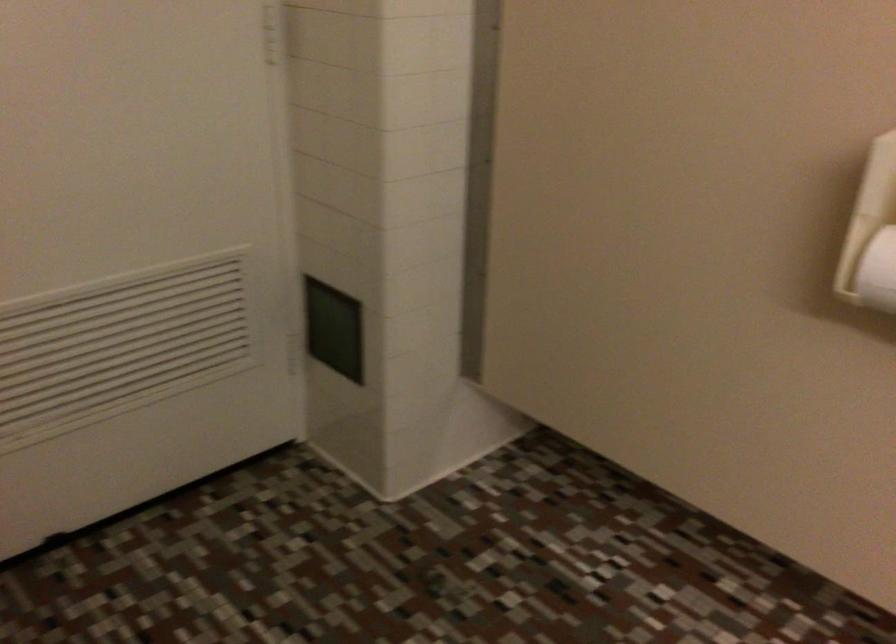
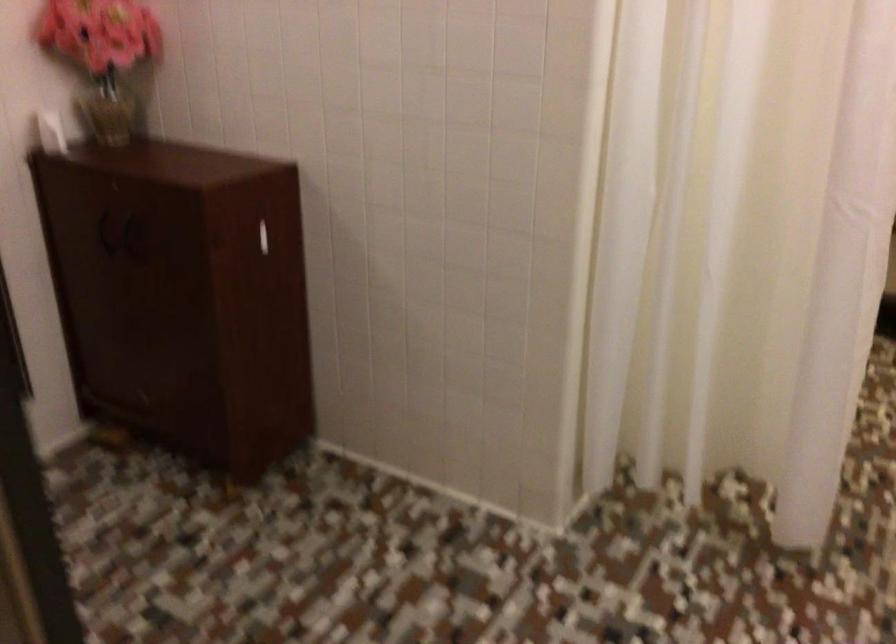
How did the camera likely rotate?

The rotation direction of the camera is right-down.